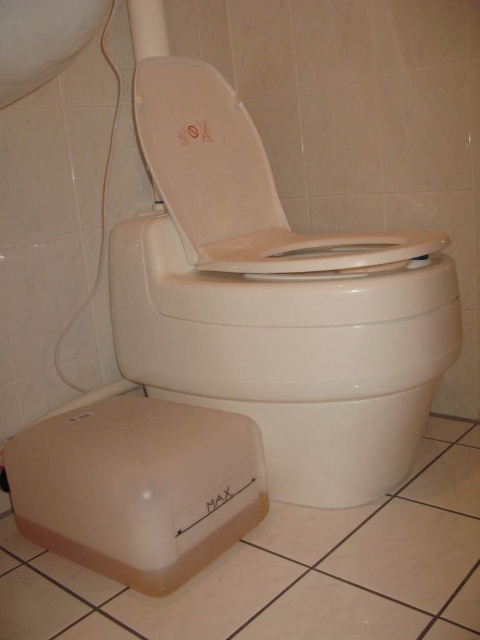
You are a plumber inspecting the toilet. You need to determine which part is higher to fix a potential overflow issue. According to the image, which part is taller between the white plastic toilet bowl at center and the white plastic toilet seat at center?

The white plastic toilet bowl at center is much taller than the white plastic toilet seat at center, so the overflow issue is likely coming from the white plastic toilet bowl at center.

You are a cleaning robot with a width of 20 centimeters. You need to clean between the white plastic toilet bowl at center and the white matte toilet seat at center. Can you fit through the space between them?

The white plastic toilet bowl at center is 21.21 centimeters from the white matte toilet seat at center, so yes, the robot can fit through the space between them since its width is 20 centimeters, which is narrower than the 21.21 centimeter gap.

You are a plumber inspecting the toilet. You see the white plastic toilet bowl at center and the white matte toilet seat at center. Which one is located below the other?

The white plastic toilet bowl at center is positioned under the white matte toilet seat at center.